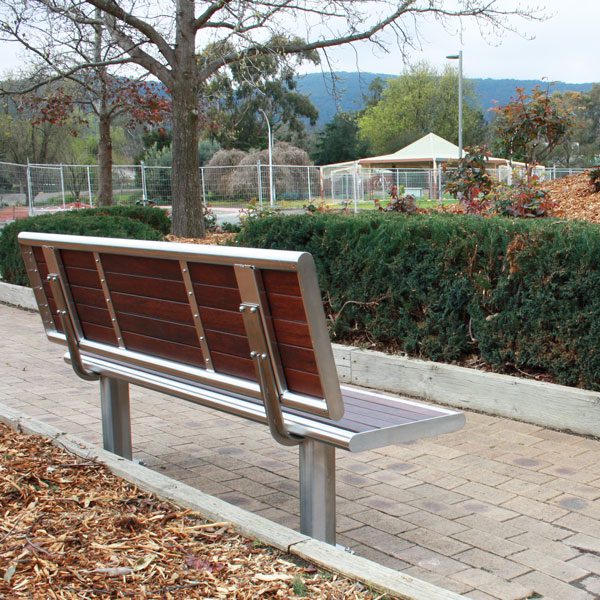
What are the coordinates of `chair` in the screenshot? It's located at (361, 419).